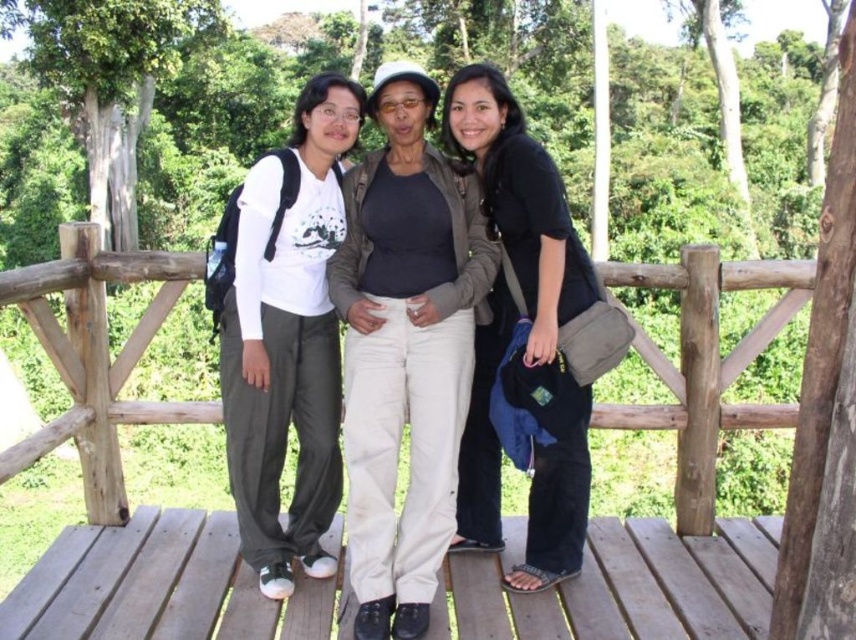
Question: Which point is farther to the camera?

Choices:
 (A) (108, 385)
 (B) (318, 228)
 (C) (663, 554)

Answer: (A)

Question: Which object is positioned farthest from the matte white shirt at center?

Choices:
 (A) light beige pants at center
 (B) black matte shirt at center
 (C) wooden bridge at center
 (D) wooden deck at center

Answer: (D)

Question: Does wooden bridge at center appear over light beige pants at center?

Choices:
 (A) no
 (B) yes

Answer: (A)

Question: Based on their relative distances, which object is nearer to the wooden bridge at center?

Choices:
 (A) wooden deck at center
 (B) light beige pants at center

Answer: (B)

Question: Does matte white shirt at center have a greater width compared to black matte shirt at center?

Choices:
 (A) no
 (B) yes

Answer: (A)

Question: Can you confirm if wooden bridge at center is positioned to the right of wooden deck at center?

Choices:
 (A) yes
 (B) no

Answer: (B)